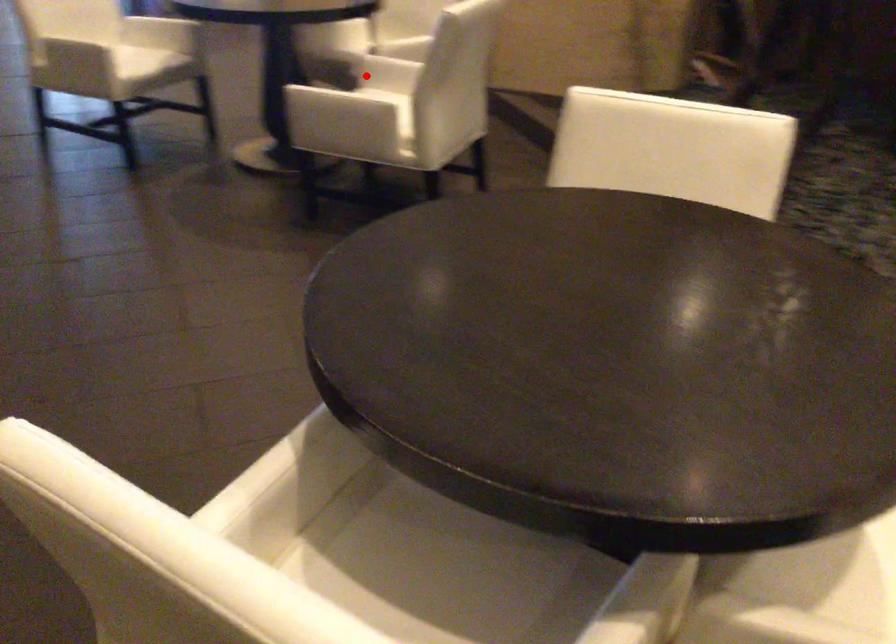
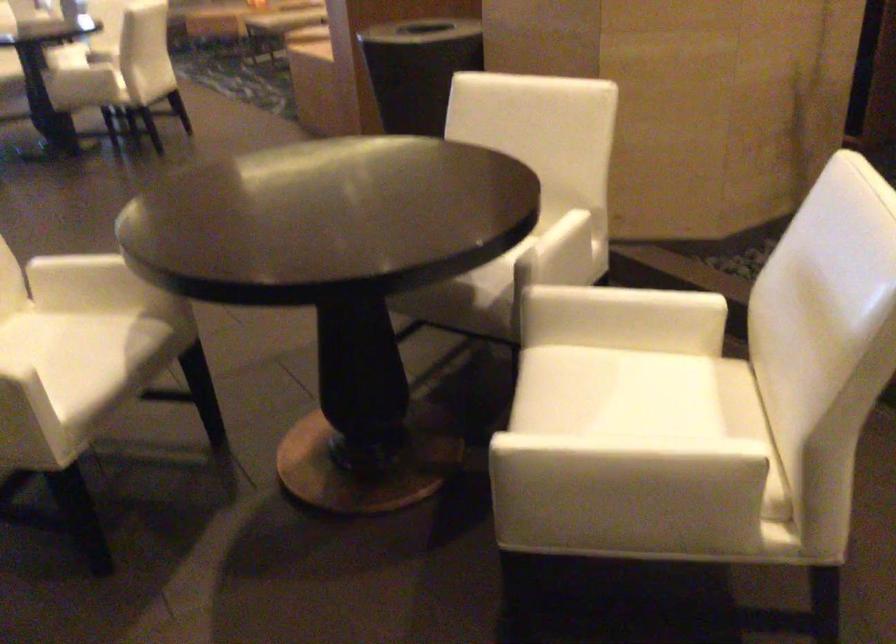
Question: I am providing you with two images of the same scene from different viewpoints. Given a red point in image1, look at the same physical point in image2. Is it:

Choices:
 (A) Closer to the viewpoint
 (B) Farther from the viewpoint

Answer: (A)